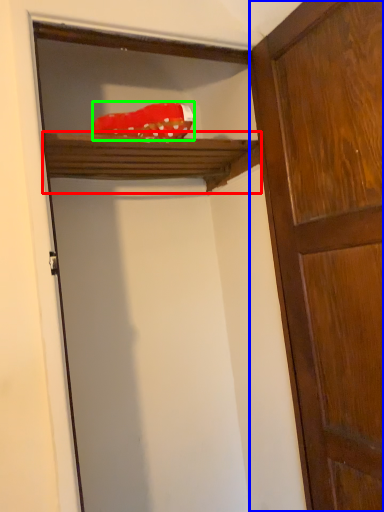
Question: Based on their relative distances, which object is farther from shelf (highlighted by a red box)? Choose from door (highlighted by a blue box) and material (highlighted by a green box).

Choices:
 (A) door
 (B) material

Answer: (A)